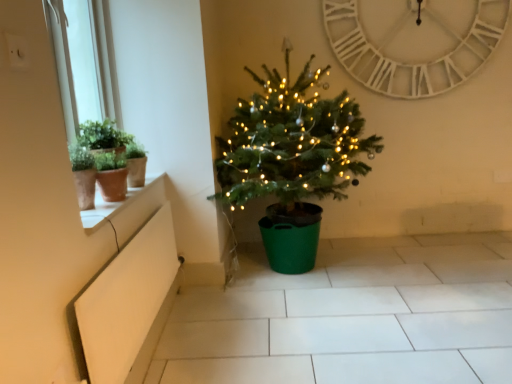
Question: From their relative heights in the image, would you say white wooden clock at upper center is taller or shorter than green matte christmas tree at center?

Choices:
 (A) tall
 (B) short

Answer: (B)

Question: Would you say white wooden clock at upper center is to the left or to the right of green matte christmas tree at center in the picture?

Choices:
 (A) left
 (B) right

Answer: (B)

Question: Based on their relative distances, which object is nearer to the white wooden clock at upper center?

Choices:
 (A) white matte window box at lower left
 (B) green matte christmas tree at center
 (C) white glossy window sill at upper left

Answer: (B)

Question: Which object is positioned farthest from the white matte window box at lower left?

Choices:
 (A) green matte christmas tree at center
 (B) white glossy window sill at upper left
 (C) white wooden clock at upper center

Answer: (C)